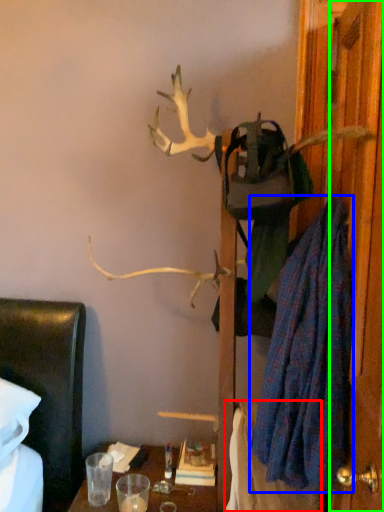
Question: Considering the real-world distances, which object is farthest from blanket (highlighted by a red box)? robe (highlighted by a blue box) or door (highlighted by a green box)?

Choices:
 (A) robe
 (B) door

Answer: (B)